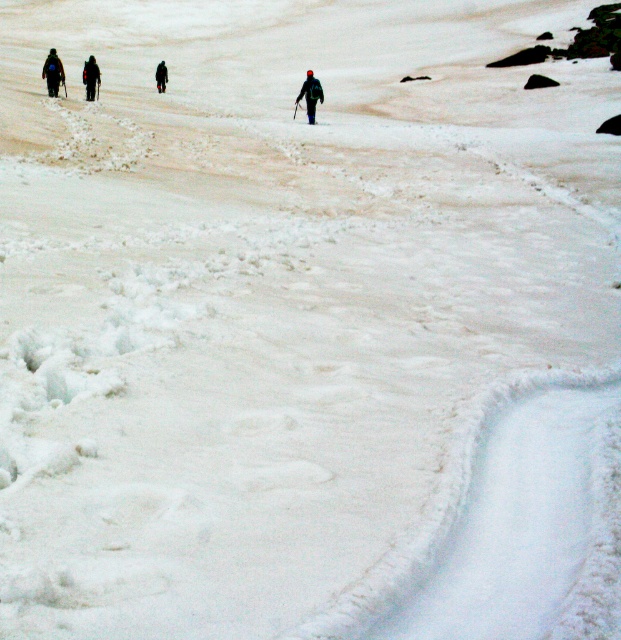
Question: Based on their relative distances, which object is nearer to the dark blue jacket at center?

Choices:
 (A) dark blue jacket at left
 (B) dark gray fabric jacket at center
 (C) black fabric jacket at upper left

Answer: (C)

Question: Which point is closer to the camera?

Choices:
 (A) (312, 74)
 (B) (161, 61)
 (C) (50, 64)

Answer: (A)

Question: Does dark blue jacket at center have a greater width compared to black fabric jacket at upper left?

Choices:
 (A) no
 (B) yes

Answer: (A)

Question: Which object is positioned farthest from the dark gray fabric jacket at center?

Choices:
 (A) black fabric jacket at upper left
 (B) dark blue jacket at left

Answer: (B)

Question: Does dark blue jacket at center have a larger size compared to black fabric jacket at upper left?

Choices:
 (A) yes
 (B) no

Answer: (B)

Question: Is dark blue jacket at center to the left of black fabric jacket at upper left from the viewer's perspective?

Choices:
 (A) yes
 (B) no

Answer: (B)